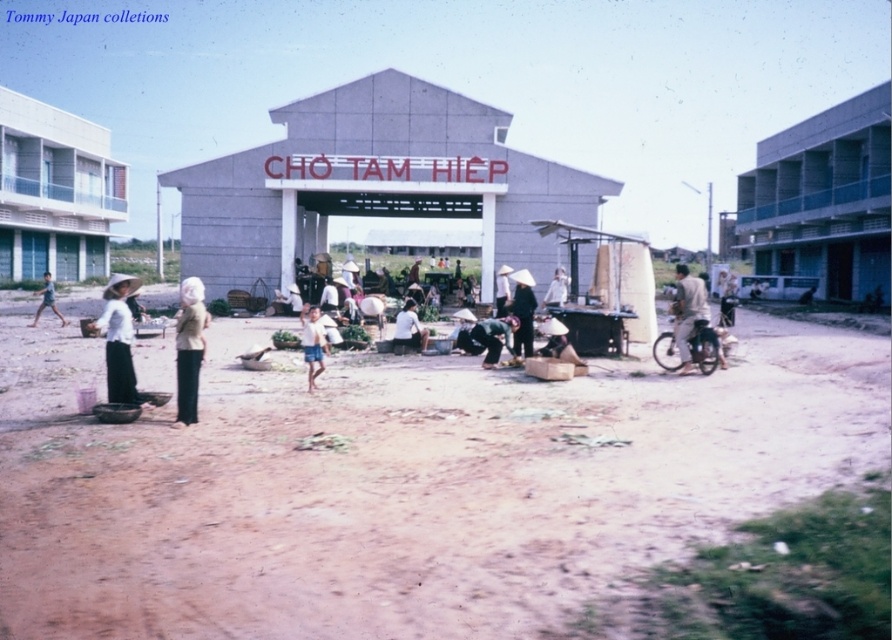
Can you confirm if light beige fabric headscarf at center is shorter than white cotton hat at center?

Incorrect, light beige fabric headscarf at center's height does not fall short of white cotton hat at center's.

Who is more distant from viewer, (182, 284) or (562, 273)?

The point (562, 273) is behind.

Identify the location of light beige fabric headscarf at center. (188, 348).

Does white matte hat at center have a lesser width compared to light beige fabric headscarf at center?

Correct, white matte hat at center's width is less than light beige fabric headscarf at center's.

Does white matte hat at center have a larger size compared to light beige fabric headscarf at center?

No.

At what (x,y) coordinates should I click in order to perform the action: click on white matte hat at center. Please return your answer as a coordinate pair (x, y). Looking at the image, I should click on point(118,339).

Can you confirm if brown dirt field at center is taller than matte white hat at center?

In fact, brown dirt field at center may be shorter than matte white hat at center.

Does brown dirt field at center appear on the right side of matte white hat at center?

Incorrect, brown dirt field at center is not on the right side of matte white hat at center.

I want to click on brown dirt field at center, so click(x=399, y=483).